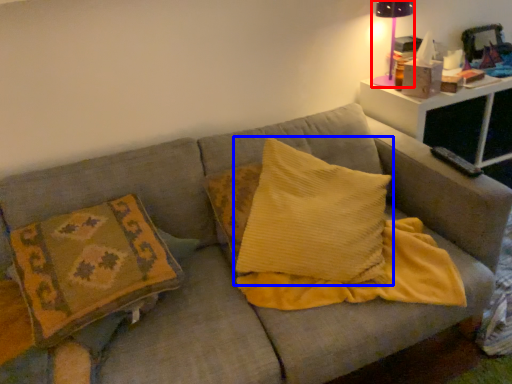
Question: Which point is closer to the camera, table lamp (highlighted by a red box) or pillow (highlighted by a blue box)?

Choices:
 (A) table lamp
 (B) pillow

Answer: (B)